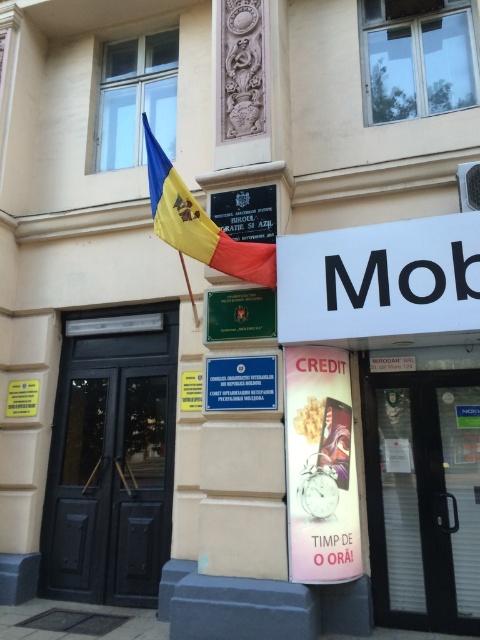
Question: Is black wooden door at left thinner than black glass door at lower right?

Choices:
 (A) yes
 (B) no

Answer: (B)

Question: Can you confirm if black wooden door at left is wider than green matte sign at center?

Choices:
 (A) no
 (B) yes

Answer: (B)

Question: Which object is closer to the camera taking this photo?

Choices:
 (A) metallic silver clock at center
 (B) green matte sign at center

Answer: (A)

Question: Which of the following is the farthest from the observer?

Choices:
 (A) white plastic sign at center
 (B) blue plastic sign at upper center

Answer: (B)

Question: Is green matte sign at center to the right of blue plastic sign at upper center from the viewer's perspective?

Choices:
 (A) no
 (B) yes

Answer: (B)

Question: Estimate the real-world distances between objects in this image. Which object is closer to the green matte sign at center?

Choices:
 (A) black wooden door at left
 (B) white plastic sign at center
 (C) blue plastic sign at upper center

Answer: (B)